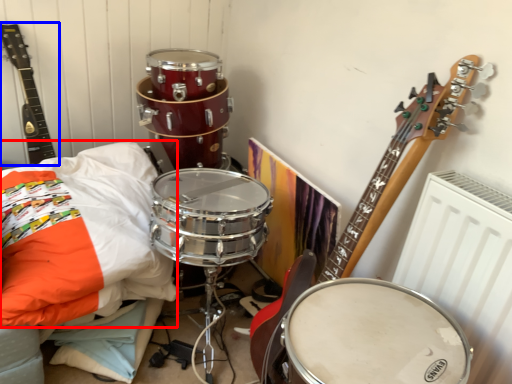
Question: Which of the following is the farthest to the observer, pillow (highlighted by a red box) or guitar (highlighted by a blue box)?

Choices:
 (A) pillow
 (B) guitar

Answer: (B)